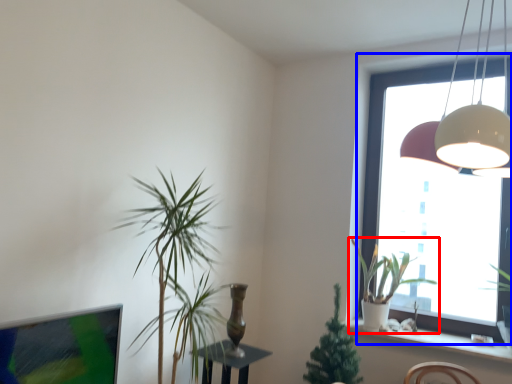
Question: Which object appears closest to the camera in this image, houseplant (highlighted by a red box) or window (highlighted by a blue box)?

Choices:
 (A) houseplant
 (B) window

Answer: (A)